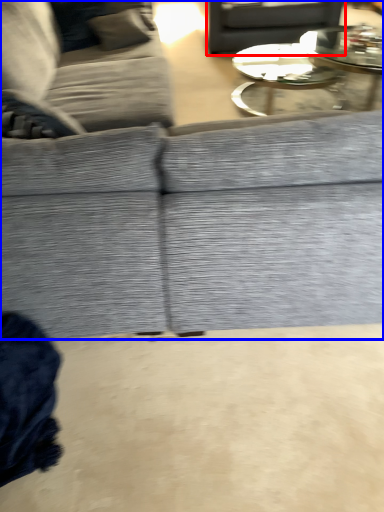
Question: Which of the following is the closest to the observer, gray (highlighted by a red box) or studio couch (highlighted by a blue box)?

Choices:
 (A) gray
 (B) studio couch

Answer: (B)